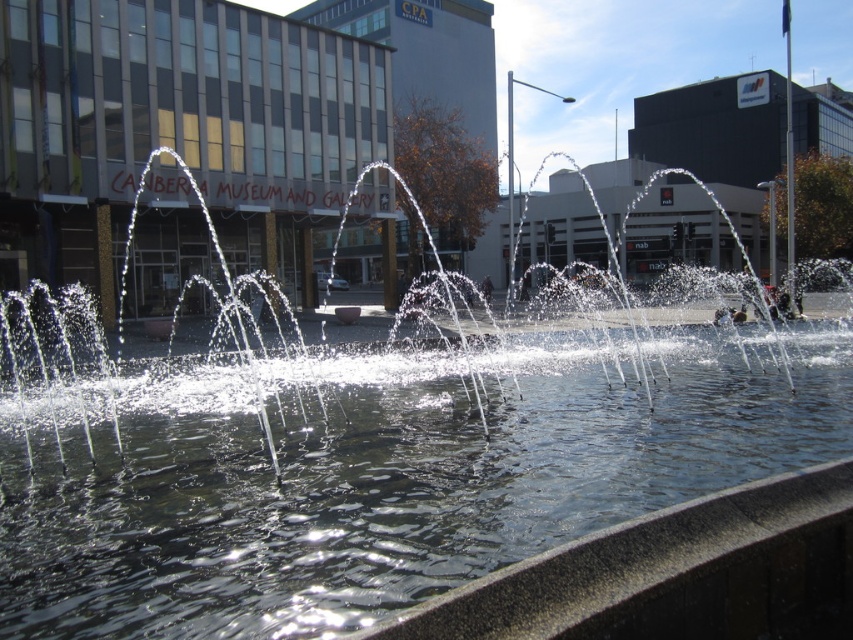
You are a tourist standing in front of the Canberra Museum and Gallery. You see the clear water fountain at center and the transparent glass building at center. Which object is closer to your left side?

The clear water fountain at center is closer to your left side because it is positioned to the left of the transparent glass building at center.

You are a tourist standing in front of the Canberra Museum and Gallery. You see the clear water at center and the transparent glass building at center. Which one is taller?

The clear water at center is not as tall as the transparent glass building at center, so the transparent glass building at center is taller.